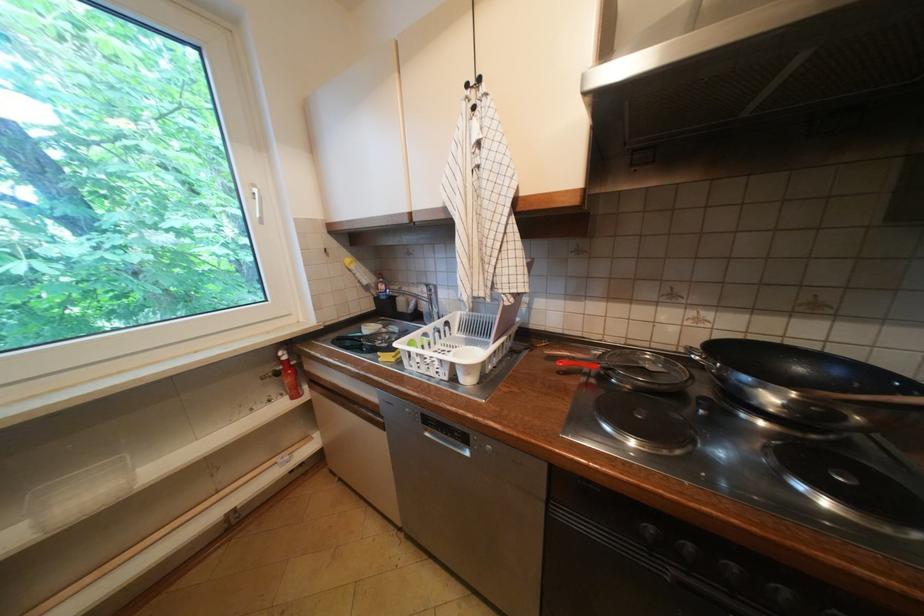
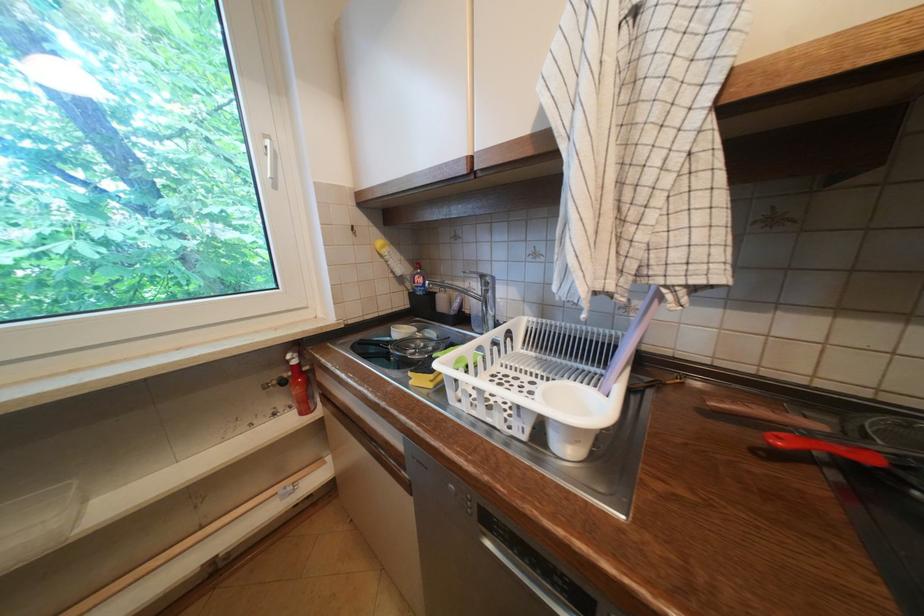
Find the pixel in the second image that matches (262,195) in the first image.

(274, 148)